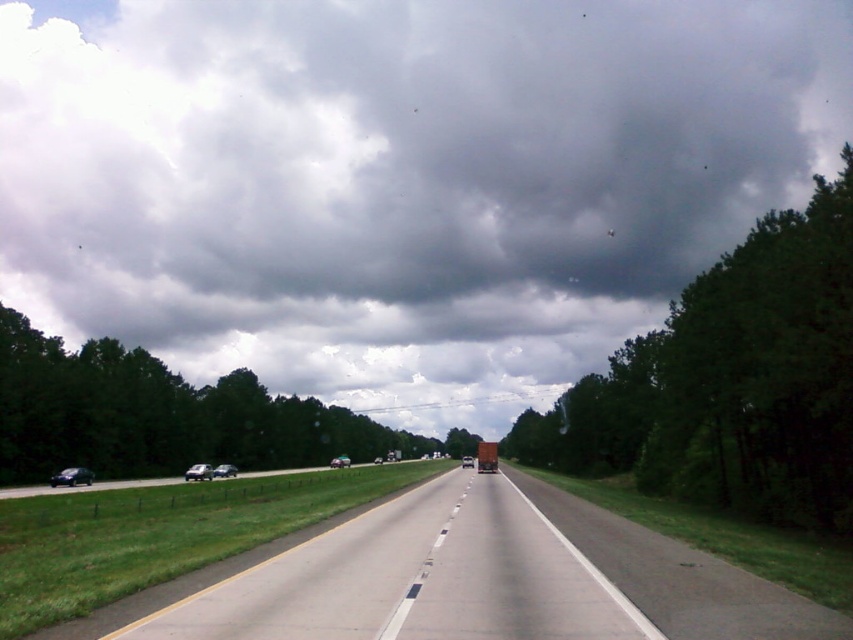
The image size is (853, 640). I want to click on green leafy tree at right, so click(730, 381).

Which is in front, point (836, 499) or point (73, 467)?

Positioned in front is point (836, 499).

Identify the location of green leafy tree at right. The image size is (853, 640). (730, 381).

You are a GUI agent. You are given a task and a screenshot of the screen. Output one action in this format:
    pyautogui.click(x=<x>, y=<y>)
    Task: Click on the green leafy tree at right
    This screenshot has width=853, height=640.
    Given the screenshot: What is the action you would take?
    pyautogui.click(x=730, y=381)

Is smooth asphalt highway at center below shiny black car at lower left?

Incorrect, smooth asphalt highway at center is not positioned below shiny black car at lower left.

Is point (395, 525) positioned in front of point (80, 476)?

Yes, it is in front of point (80, 476).

Where is `smooth asphalt highway at center`? The height and width of the screenshot is (640, 853). smooth asphalt highway at center is located at coordinates (466, 579).

Identify the location of smooth asphalt highway at center. (466, 579).

Who is more forward, (541,458) or (123,372)?

Point (123,372) is more forward.

Does green leafy tree at right appear under green leafy tree at left?

No.

Does point (685, 493) come farther from viewer compared to point (88, 387)?

No, (685, 493) is in front of (88, 387).

The height and width of the screenshot is (640, 853). I want to click on green leafy tree at right, so click(x=730, y=381).